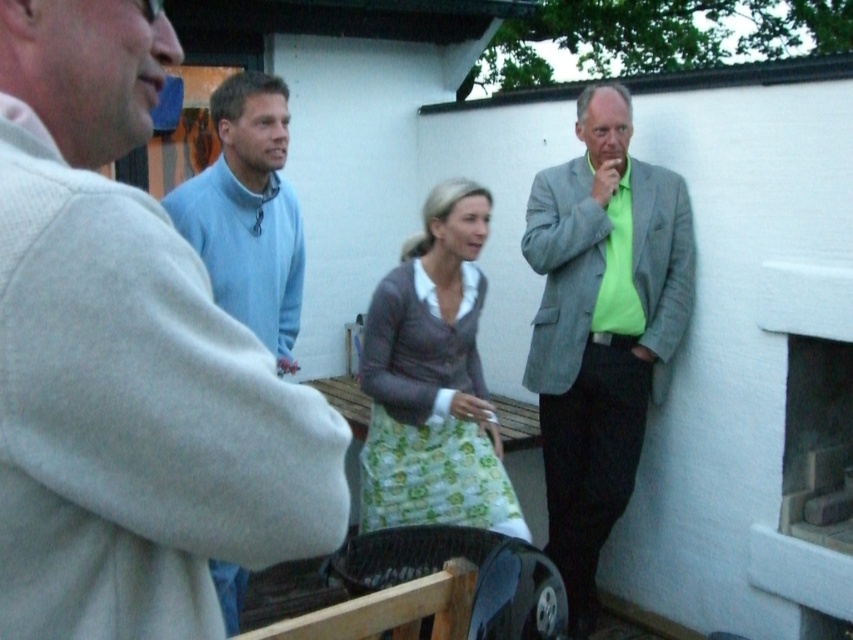
Is point (33, 502) more distant than point (804, 518)?

No, it is not.

Between light gray sweater at upper left and white stone fireplace at right, which one appears on the right side from the viewer's perspective?

Positioned to the right is white stone fireplace at right.

This screenshot has height=640, width=853. Find the location of `light gray sweater at upper left`. light gray sweater at upper left is located at coordinates (126, 362).

Find the location of a particular element. light gray sweater at upper left is located at coordinates (126, 362).

Does green floral apron at center appear over white stone fireplace at right?

Yes, green floral apron at center is above white stone fireplace at right.

At what (x,y) coordinates should I click in order to perform the action: click on green floral apron at center. Please return your answer as a coordinate pair (x, y). The height and width of the screenshot is (640, 853). Looking at the image, I should click on (433, 380).

Looking at this image, is white stone fireplace at right wider than light blue sweater at upper left?

Yes, white stone fireplace at right is wider than light blue sweater at upper left.

Who is shorter, white stone fireplace at right or light blue sweater at upper left?

light blue sweater at upper left

The height and width of the screenshot is (640, 853). Find the location of `white stone fireplace at right`. white stone fireplace at right is located at coordinates (810, 442).

I want to click on white stone fireplace at right, so 810,442.